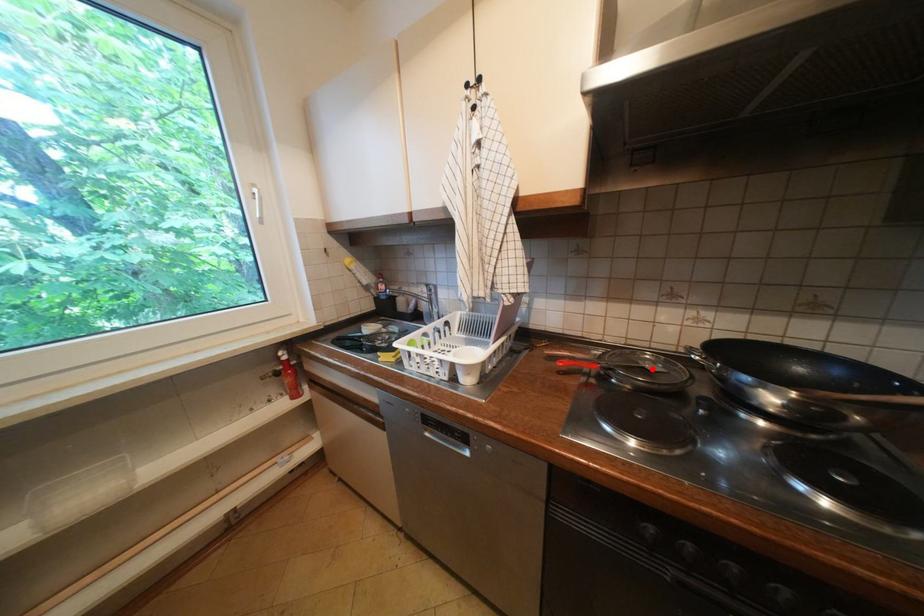
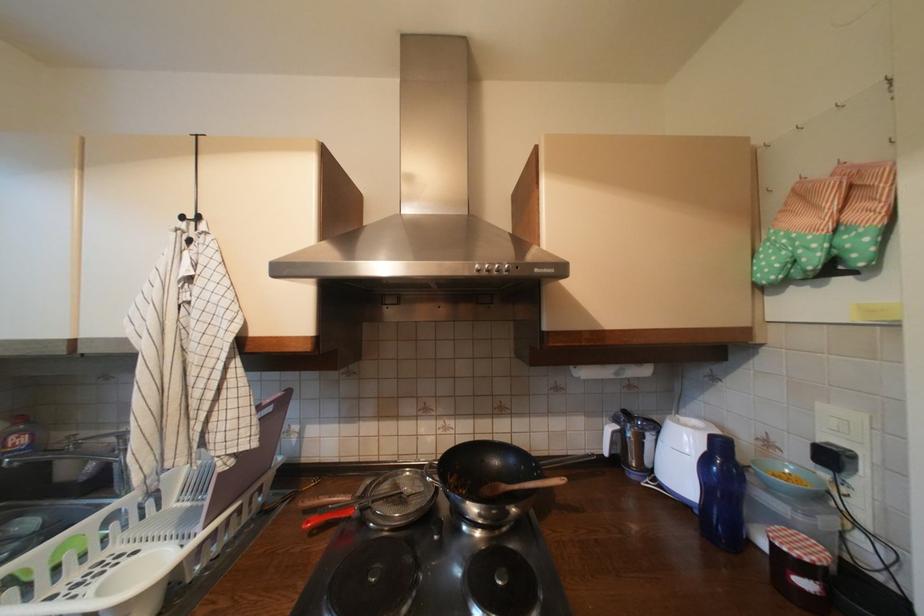
The point at the highlighted location is marked in the first image. Where is the corresponding point in the second image?

(410, 495)